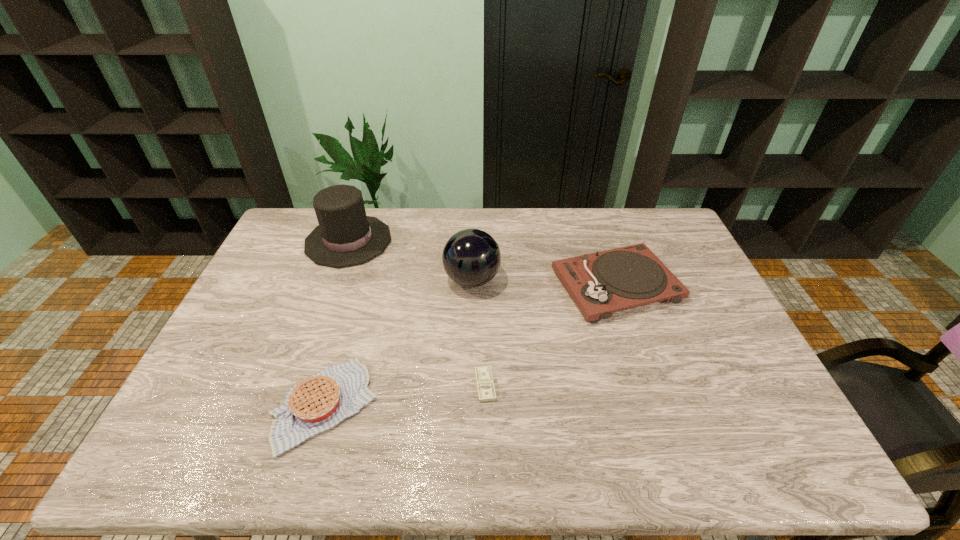
You are a GUI agent. You are given a task and a screenshot of the screen. Output one action in this format:
    pyautogui.click(x=<x>, y=<y>)
    Task: Click on the vacant area at the far left corner of the desktop
    The width and height of the screenshot is (960, 540).
    Given the screenshot: What is the action you would take?
    [304, 225]

In the image, there is a desktop. At what (x,y) coordinates should I click in order to perform the action: click on vacant region at the far right corner. Please return your answer as a coordinate pair (x, y). Image resolution: width=960 pixels, height=540 pixels. Looking at the image, I should click on (654, 210).

Locate an element on the screen. This screenshot has width=960, height=540. empty location between the shortest object and the pie is located at coordinates pyautogui.click(x=405, y=395).

Find the location of a particular element. free space between the dress hat and the bowling ball is located at coordinates (410, 260).

I want to click on unoccupied position between the money and the fourth tallest object, so [405, 395].

Find the location of a particular element. The height and width of the screenshot is (540, 960). free space between the phonograph_record and the shortest object is located at coordinates (551, 335).

Locate an element on the screen. unoccupied position between the bowling ball and the money is located at coordinates (478, 333).

What are the coordinates of `vacant area between the bowling ball and the dress hat` in the screenshot? It's located at (410, 260).

Where is `empty space that is in between the rightmost object and the money`? This screenshot has height=540, width=960. empty space that is in between the rightmost object and the money is located at coordinates (551, 335).

Find the location of a particular element. The image size is (960, 540). unoccupied position between the shortest object and the dress hat is located at coordinates (417, 313).